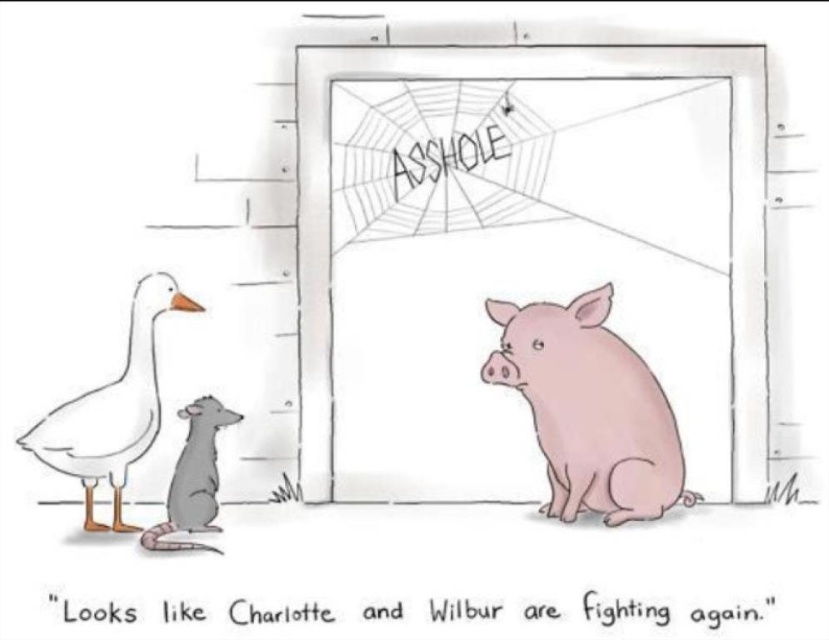
Question: Can you confirm if pink matte pig at right is positioned above gray matte rat at lower left?

Choices:
 (A) yes
 (B) no

Answer: (A)

Question: Is pink matte pig at right below white matte duck at left?

Choices:
 (A) no
 (B) yes

Answer: (B)

Question: Which of these objects is positioned closest to the pink matte pig at right?

Choices:
 (A) white matte duck at left
 (B) gray matte rat at lower left

Answer: (B)

Question: Can you confirm if pink matte pig at right is bigger than white matte duck at left?

Choices:
 (A) yes
 (B) no

Answer: (A)

Question: Among these objects, which one is farthest from the camera?

Choices:
 (A) pink matte pig at right
 (B) gray matte rat at lower left
 (C) white matte duck at left

Answer: (A)

Question: Which object is the farthest from the pink matte pig at right?

Choices:
 (A) white matte duck at left
 (B) gray matte rat at lower left

Answer: (A)